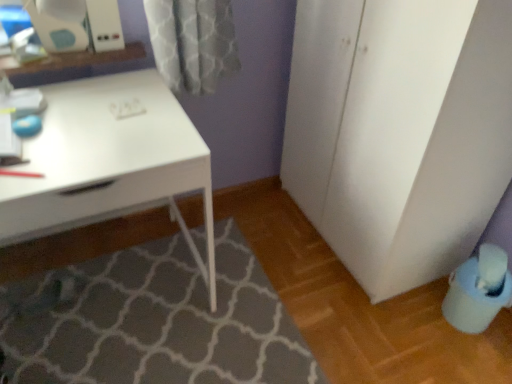
Question: Is white glossy desk at upper left bigger or smaller than white matte cabinet at right?

Choices:
 (A) small
 (B) big

Answer: (A)

Question: From their relative heights in the image, would you say white glossy desk at upper left is taller or shorter than white matte cabinet at right?

Choices:
 (A) tall
 (B) short

Answer: (B)

Question: Which object is positioned farthest from the blue plastic swivel chair at lower right?

Choices:
 (A) white matte cabinet at right
 (B) white glossy desk at upper left
 (C) gray textured bath mat at lower center

Answer: (B)

Question: Based on their relative distances, which object is farther from the blue plastic swivel chair at lower right?

Choices:
 (A) gray textured bath mat at lower center
 (B) white matte cabinet at right
 (C) white glossy desk at upper left

Answer: (C)